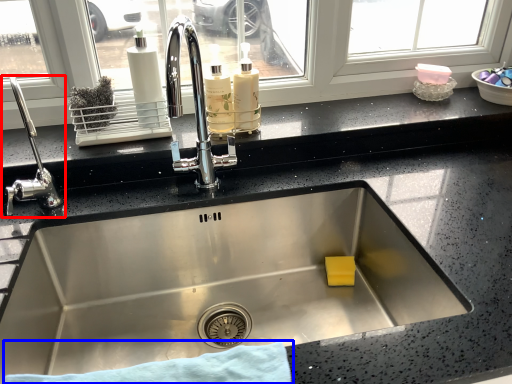
Question: Which object is closer to the camera taking this photo, tap (highlighted by a red box) or bath towel (highlighted by a blue box)?

Choices:
 (A) tap
 (B) bath towel

Answer: (B)